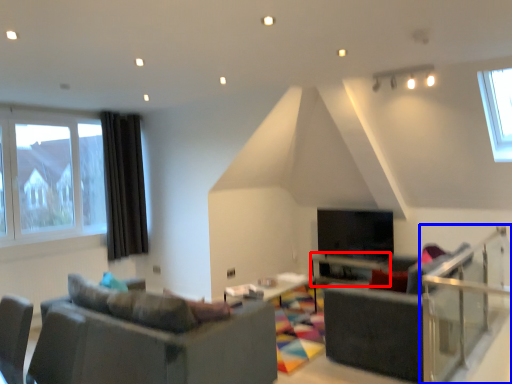
Question: Which object appears farthest to the camera in this image, table (highlighted by a red box) or balustrade (highlighted by a blue box)?

Choices:
 (A) table
 (B) balustrade

Answer: (A)